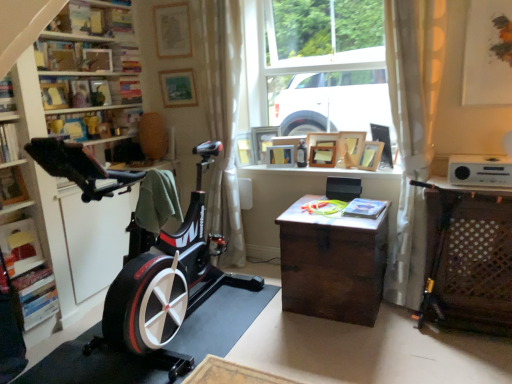
This screenshot has height=384, width=512. Identify the location of vacant area in front of wooden chest at center. (351, 347).